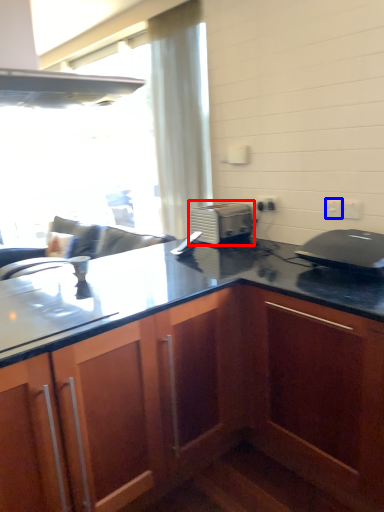
Question: Which object appears farthest to the camera in this image, toaster (highlighted by a red box) or electric outlet (highlighted by a blue box)?

Choices:
 (A) toaster
 (B) electric outlet

Answer: (A)